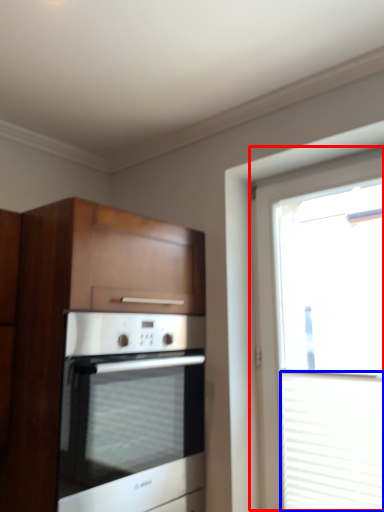
Question: Which of the following is the closest to the observer, window (highlighted by a red box) or blind (highlighted by a blue box)?

Choices:
 (A) window
 (B) blind

Answer: (A)